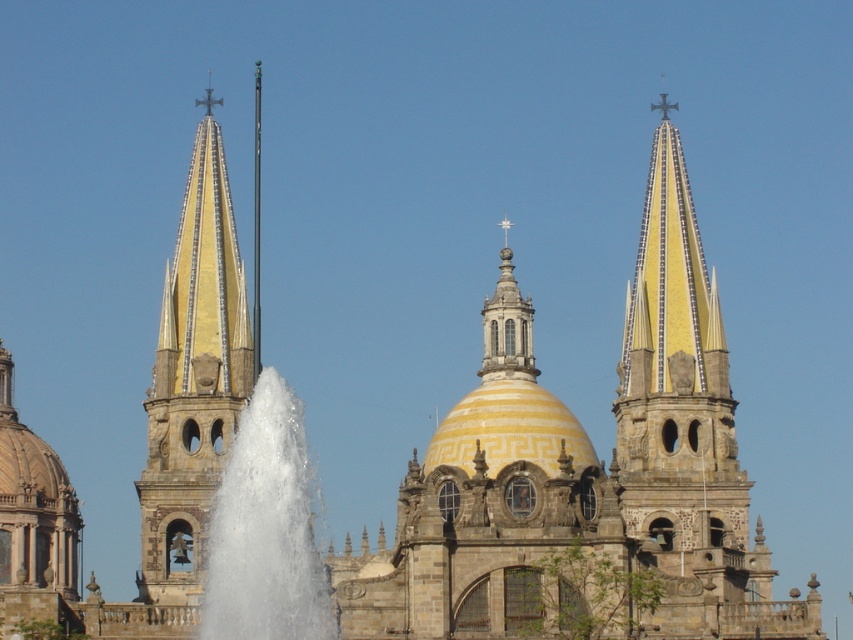
I want to click on gold mosaic steeple at center, so click(196, 371).

Does gold mosaic steeple at center appear under white frothy water at center?

No, gold mosaic steeple at center is not below white frothy water at center.

Between point (170, 368) and point (308, 563), which one is positioned in front?

Point (308, 563) is more forward.

Where is `gold mosaic steeple at center`? gold mosaic steeple at center is located at coordinates (196, 371).

From the picture: Between yellow stone spire at upper right and gold mosaic steeple at center, which one is positioned lower?

gold mosaic steeple at center is lower down.

Is yellow stone spire at upper right below gold mosaic steeple at center?

Incorrect, yellow stone spire at upper right is not positioned below gold mosaic steeple at center.

Find the location of `yellow stone spire at upper right`. yellow stone spire at upper right is located at coordinates (675, 378).

Can you confirm if yellow stone spire at upper right is shorter than white frothy water at center?

Incorrect, yellow stone spire at upper right's height does not fall short of white frothy water at center's.

The image size is (853, 640). What do you see at coordinates (675, 378) in the screenshot?
I see `yellow stone spire at upper right` at bounding box center [675, 378].

The image size is (853, 640). Identify the location of yellow stone spire at upper right. (675, 378).